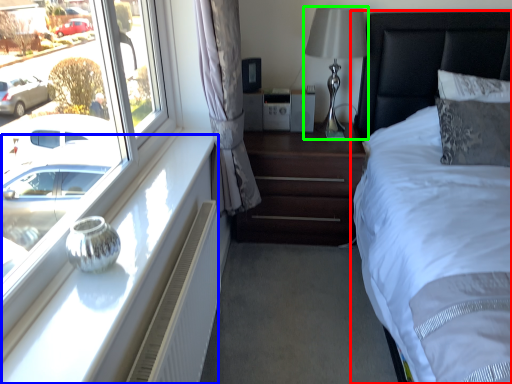
Question: Based on their relative distances, which object is nearer to bed (highlighted by a red box)? Choose from window sill (highlighted by a blue box) and bedside lamp (highlighted by a green box).

Choices:
 (A) window sill
 (B) bedside lamp

Answer: (B)